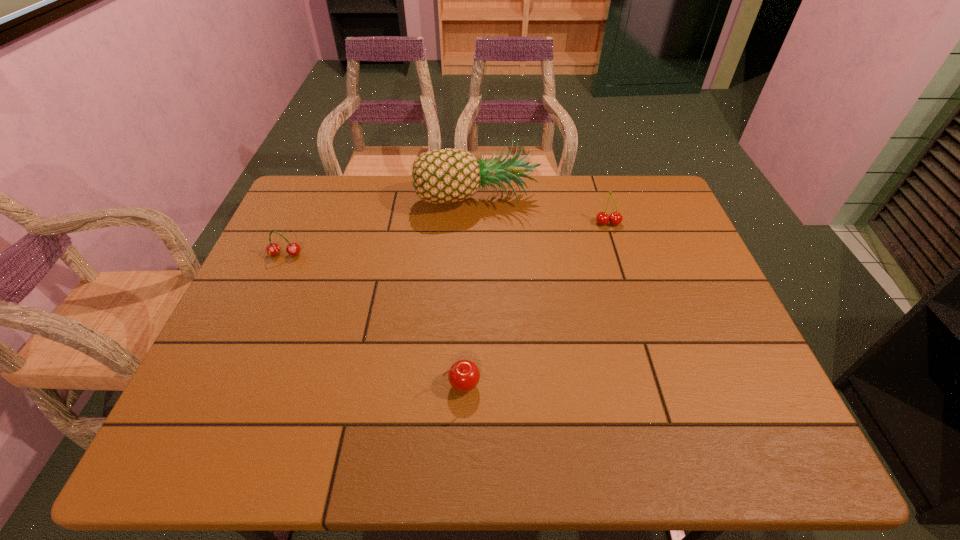
Locate which object ranks third in proximity to the pineapple. Please provide its 2D coordinates. Your answer should be formatted as a tuple, i.e. [(x, y)], where the tuple contains the x and y coordinates of a point satisfying the conditions above.

[(463, 375)]

I want to click on cherry that is the closest to the second nearest cherry, so click(x=463, y=375).

Select which cherry is the closest to the pineapple. Please provide its 2D coordinates. Your answer should be formatted as a tuple, i.e. [(x, y)], where the tuple contains the x and y coordinates of a point satisfying the conditions above.

[(602, 218)]

Where is `free region that satisfies the following two spatial constraints: 1. with stems pointing upwards on the second cherry from right to left; 2. on the left side of the leftmost object`? free region that satisfies the following two spatial constraints: 1. with stems pointing upwards on the second cherry from right to left; 2. on the left side of the leftmost object is located at coordinates (227, 385).

Where is `vacant position in the image that satisfies the following two spatial constraints: 1. with stems pointing upwards on the leftmost cherry; 2. on the right side of the nearest object`? The width and height of the screenshot is (960, 540). vacant position in the image that satisfies the following two spatial constraints: 1. with stems pointing upwards on the leftmost cherry; 2. on the right side of the nearest object is located at coordinates (227, 385).